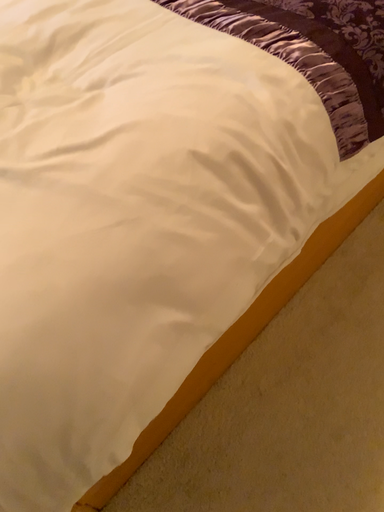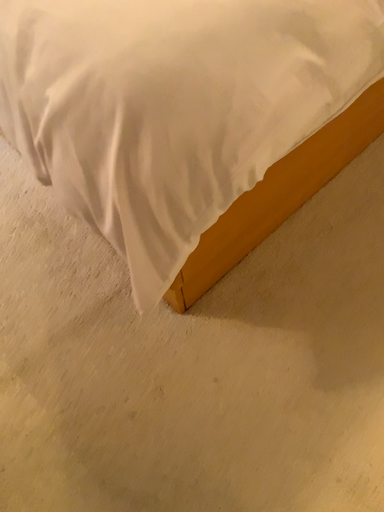
Question: How did the camera likely rotate when shooting the video?

Choices:
 (A) rotated downward
 (B) rotated upward

Answer: (A)